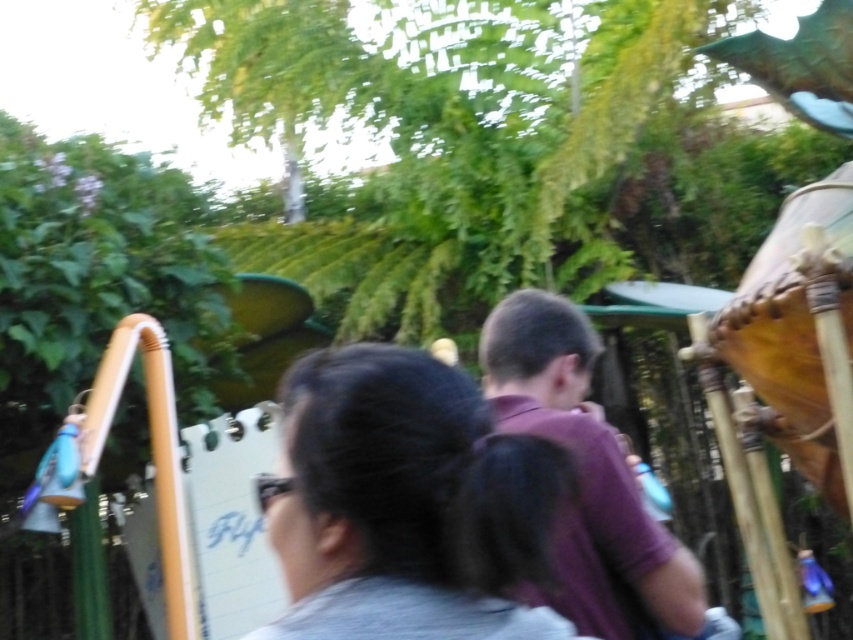
Question: Can you confirm if gray matte hair at center is wider than purple matte shirt at center?

Choices:
 (A) no
 (B) yes

Answer: (A)

Question: Can you confirm if gray matte hair at center is smaller than purple matte shirt at center?

Choices:
 (A) yes
 (B) no

Answer: (A)

Question: Which point appears closest to the camera in this image?

Choices:
 (A) (496, 401)
 (B) (403, 364)

Answer: (B)

Question: Is gray matte hair at center positioned before purple matte shirt at center?

Choices:
 (A) no
 (B) yes

Answer: (B)

Question: Among these points, which one is nearest to the camera?

Choices:
 (A) tap(314, 627)
 (B) tap(553, 385)

Answer: (A)